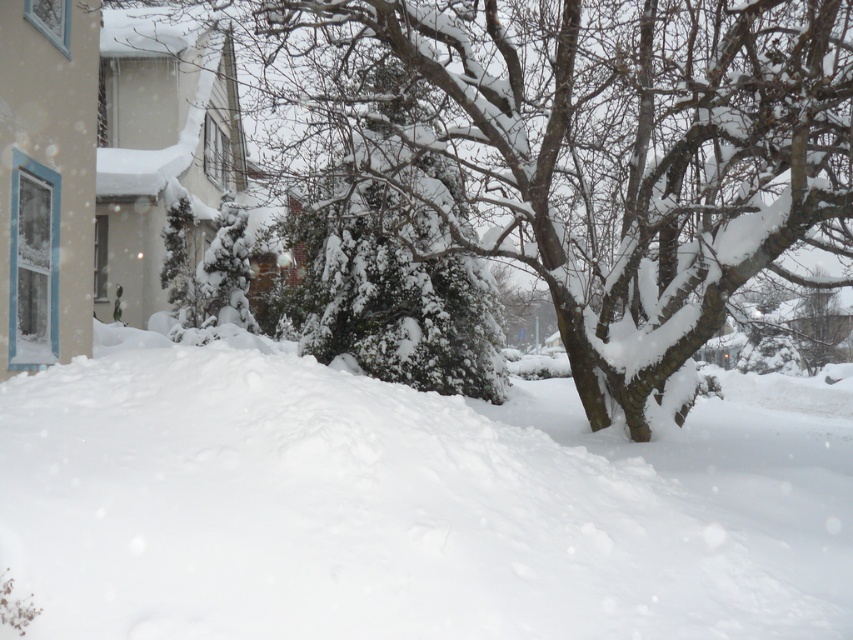
Is white fluffy snow at center shorter than snow-covered tree at center?

Yes, white fluffy snow at center is shorter than snow-covered tree at center.

You are a GUI agent. You are given a task and a screenshot of the screen. Output one action in this format:
    pyautogui.click(x=<x>, y=<y>)
    Task: Click on the white fluffy snow at center
    
    Given the screenshot: What is the action you would take?
    pyautogui.click(x=410, y=504)